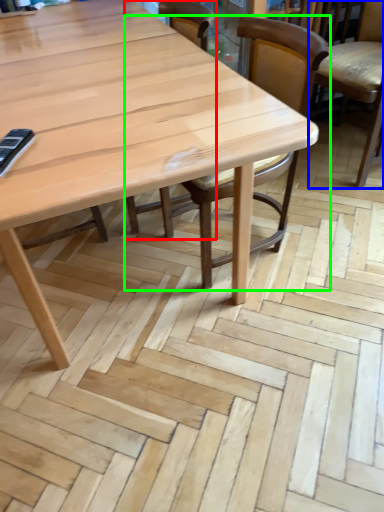
Question: Estimate the real-world distances between objects in this image. Which object is closer to chair (highlighted by a red box), chair (highlighted by a blue box) or chair (highlighted by a green box)?

Choices:
 (A) chair
 (B) chair

Answer: (B)